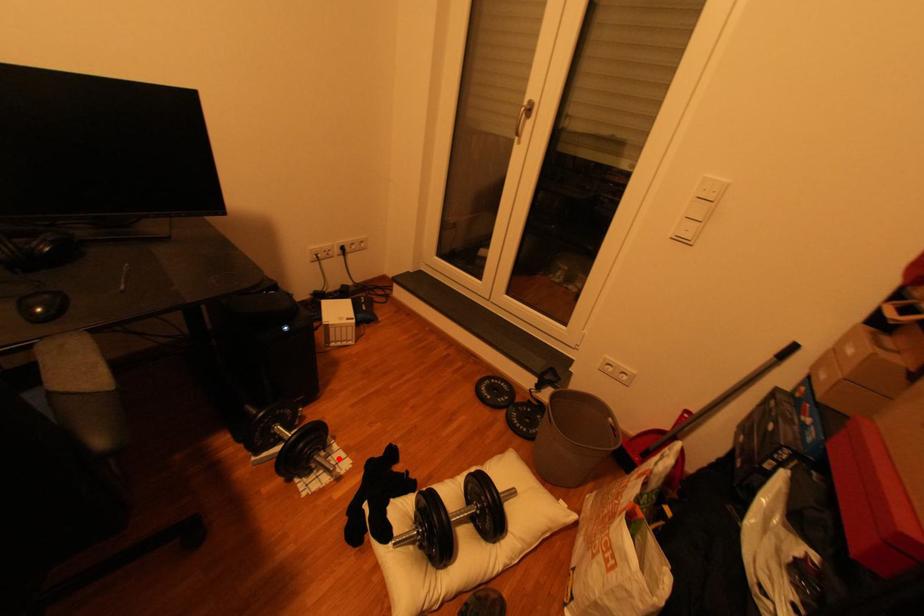
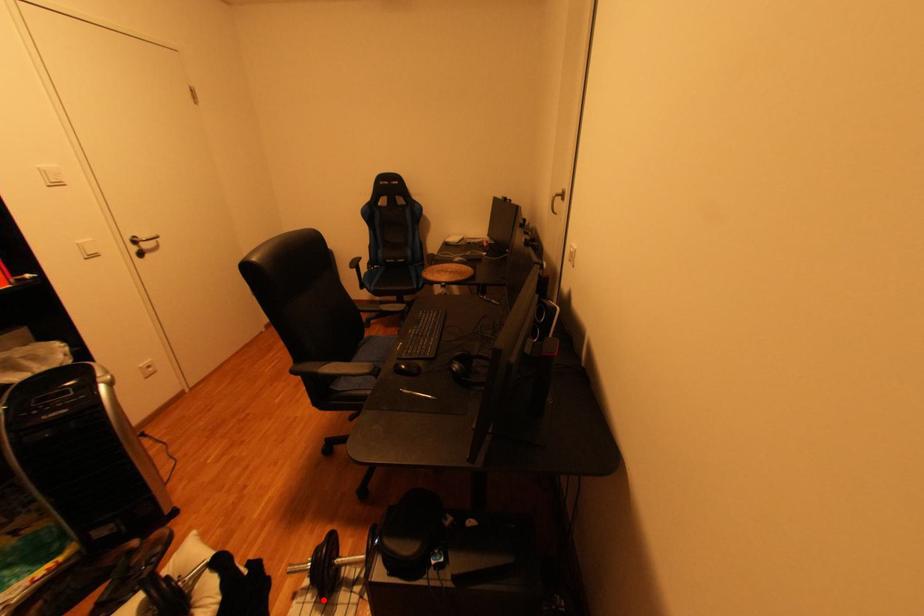
I am providing you with two images of the same scene from different viewpoints. A red point is marked on the first image and another point is marked on the second image. Is the marked point in image1 the same physical position as the marked point in image2?

Yes